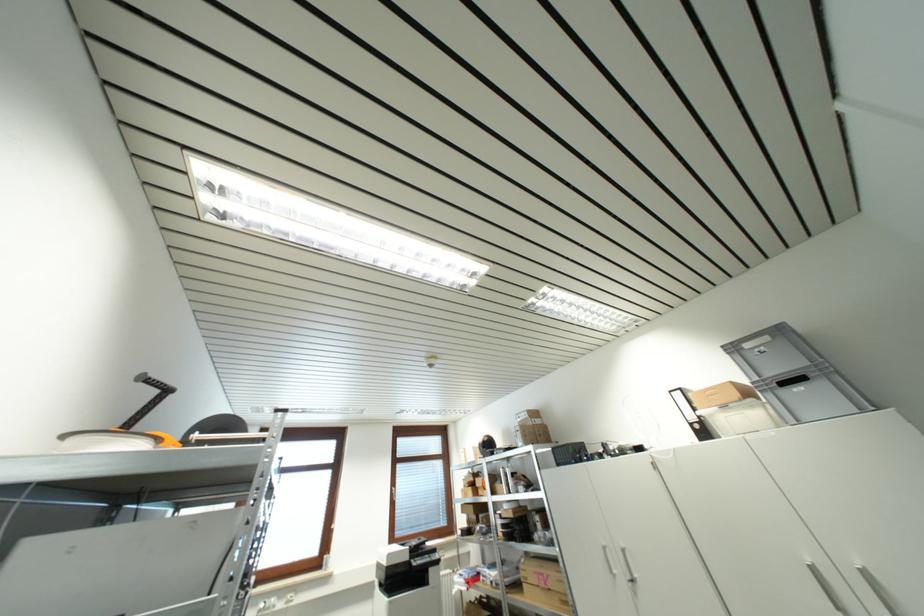
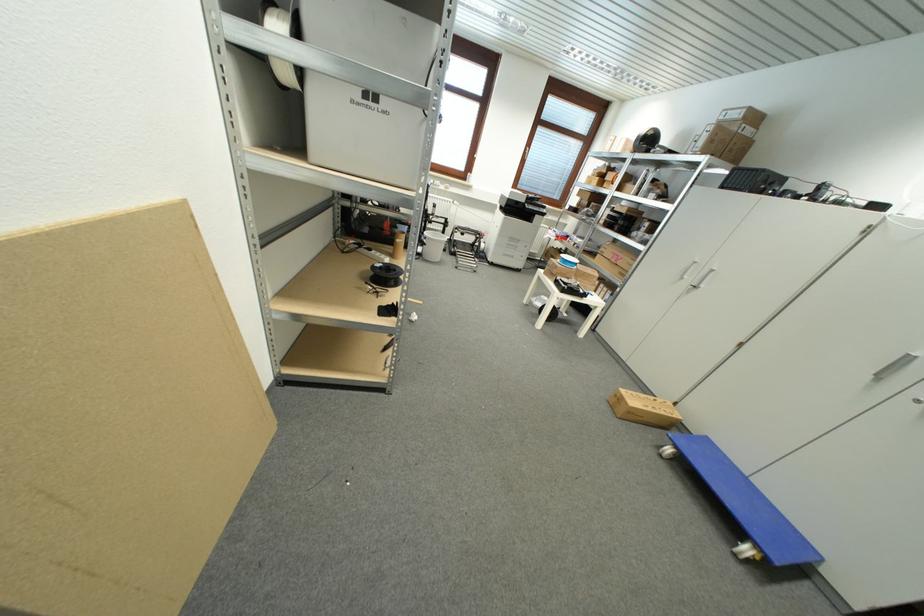
Find the pixel in the second image that matches [542,424] in the first image.

(754, 134)